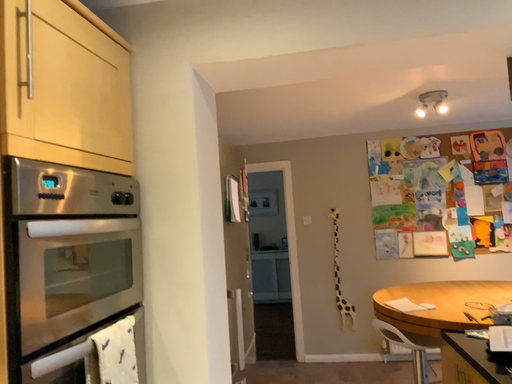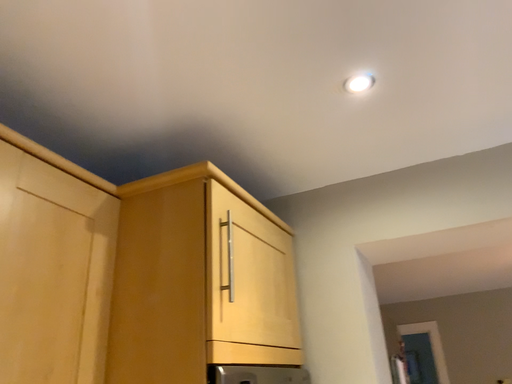
Question: Which way did the camera rotate in the video?

Choices:
 (A) rotated upward
 (B) rotated downward

Answer: (A)